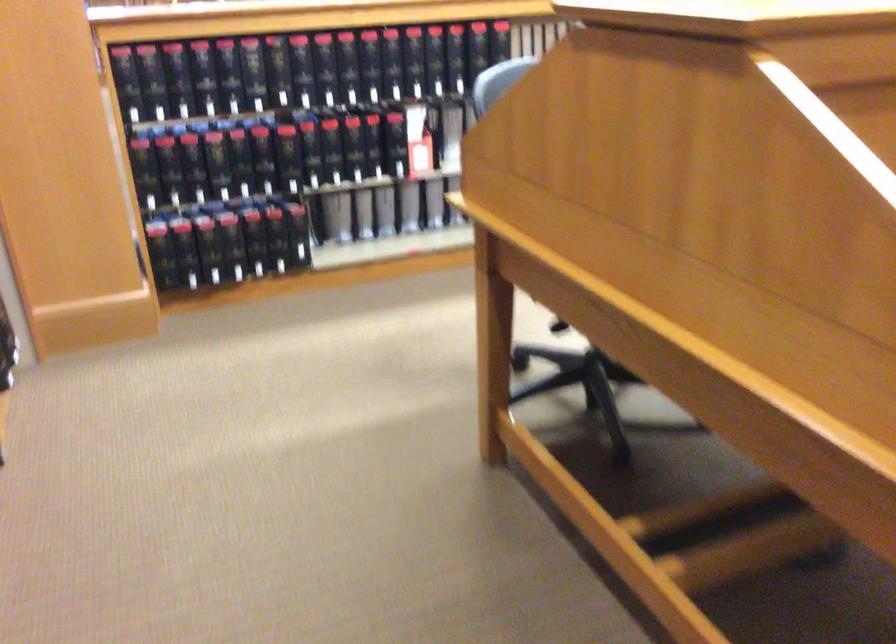
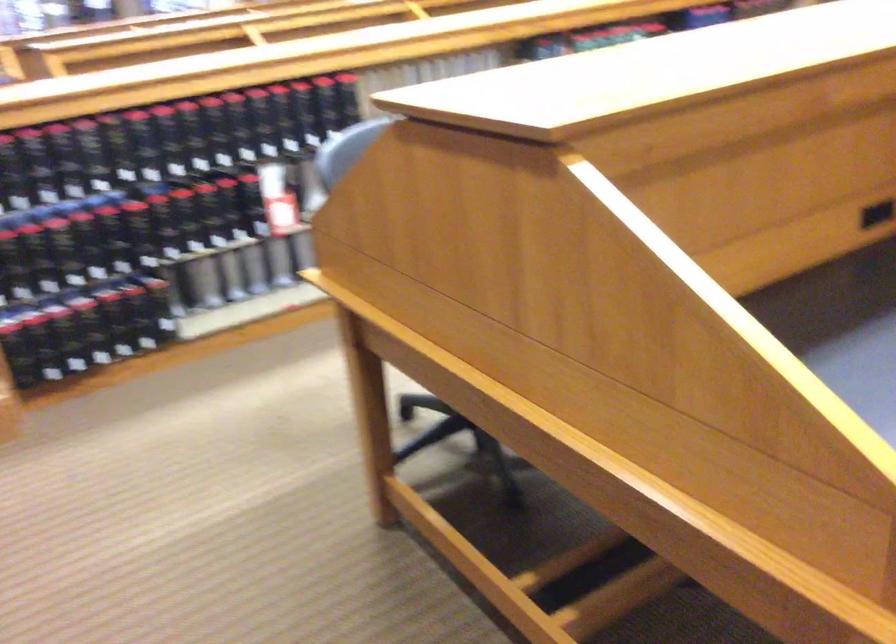
Question: In a continuous first-person perspective shot, in which direction is the camera moving?

Choices:
 (A) Left
 (B) Right
 (C) Forward
 (D) Backward

Answer: (B)